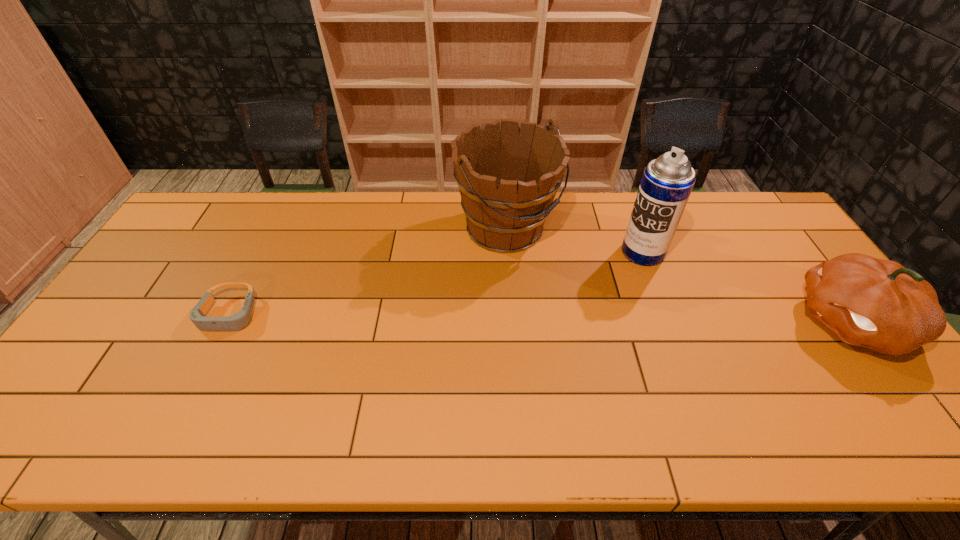
Where is `free space on the desktop that is between the leftmost object and the pumpkin and is positioned on the label side of the aerosol can`? The width and height of the screenshot is (960, 540). free space on the desktop that is between the leftmost object and the pumpkin and is positioned on the label side of the aerosol can is located at coordinates (548, 318).

You are a GUI agent. You are given a task and a screenshot of the screen. Output one action in this format:
    pyautogui.click(x=<x>, y=<y>)
    Task: Click on the vacant space on the desktop that is between the shortest object and the second shortest object and is positioned with the handle on the wine bucket
    The width and height of the screenshot is (960, 540).
    Given the screenshot: What is the action you would take?
    pyautogui.click(x=619, y=319)